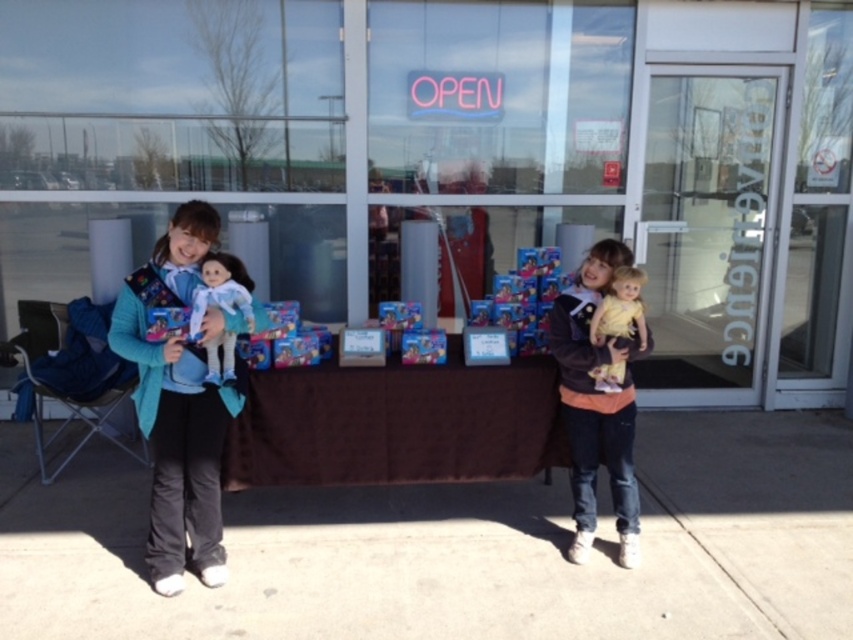
From the picture: You are trying to place the velvet brown jacket at center on the brown fabric table at center. Based on their sizes, will the jacket fit entirely on the table?

The brown fabric table at center has a larger width than the velvet brown jacket at center, so the jacket will fit entirely on the table.